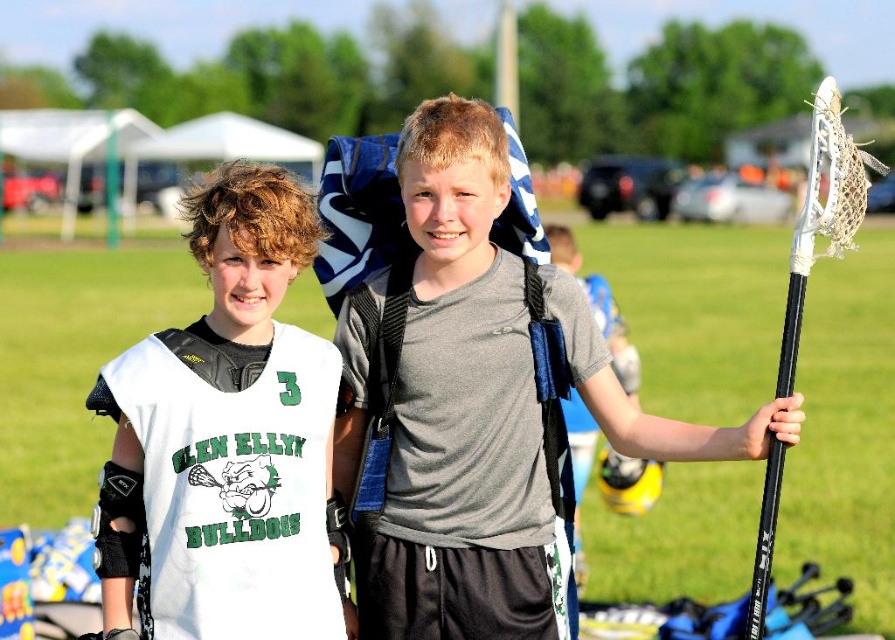
Can you confirm if white matte jersey at center is thinner than black matte lacrosse stick at right?

Indeed, white matte jersey at center has a lesser width compared to black matte lacrosse stick at right.

Does point (241, 234) come closer to viewer compared to point (834, 186)?

Yes.

Identify the location of white matte jersey at center. Image resolution: width=895 pixels, height=640 pixels. (228, 436).

Can you confirm if gray matte shirt at center is smaller than black matte lacrosse stick at right?

Yes, gray matte shirt at center is smaller than black matte lacrosse stick at right.

How much distance is there between gray matte shirt at center and black matte lacrosse stick at right?

gray matte shirt at center is 6.63 feet from black matte lacrosse stick at right.

Which is in front, point (607, 378) or point (780, 484)?

Point (780, 484) is more forward.

You are a GUI agent. You are given a task and a screenshot of the screen. Output one action in this format:
    pyautogui.click(x=<x>, y=<y>)
    Task: Click on the gray matte shirt at center
    This screenshot has height=640, width=895.
    Given the screenshot: What is the action you would take?
    pyautogui.click(x=461, y=412)

This screenshot has height=640, width=895. I want to click on gray matte shirt at center, so click(x=461, y=412).

Is point (501, 195) farther from camera compared to point (145, 380)?

Yes, it is.

I want to click on gray matte shirt at center, so click(x=461, y=412).